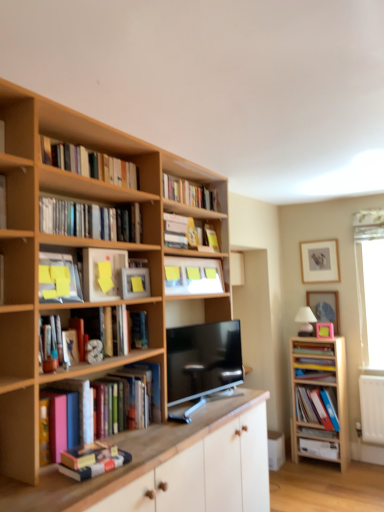
Where is `free space above matte blue book at right, which is the 2th book in bottom-to-top order (from a real-world perspective)`? Image resolution: width=384 pixels, height=512 pixels. free space above matte blue book at right, which is the 2th book in bottom-to-top order (from a real-world perspective) is located at coordinates (323, 368).